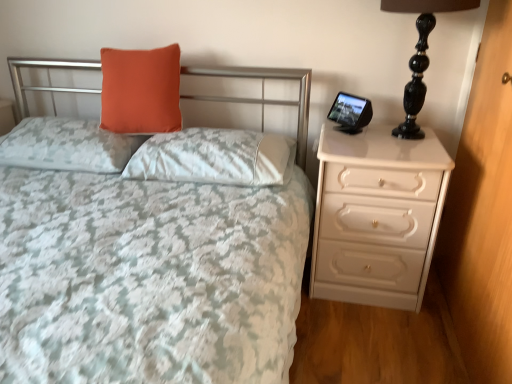
Question: Considering the relative sizes of matte white bedspread at center and white glossy dresser at right in the image provided, is matte white bedspread at center taller than white glossy dresser at right?

Choices:
 (A) yes
 (B) no

Answer: (B)

Question: Can you confirm if matte white bedspread at center is positioned to the right of white glossy dresser at right?

Choices:
 (A) no
 (B) yes

Answer: (A)

Question: Is matte white bedspread at center further to the viewer compared to white glossy dresser at right?

Choices:
 (A) no
 (B) yes

Answer: (A)

Question: Considering the relative positions of matte white bedspread at center and white glossy dresser at right in the image provided, is matte white bedspread at center in front of white glossy dresser at right?

Choices:
 (A) no
 (B) yes

Answer: (B)

Question: From a real-world perspective, is matte white bedspread at center under white glossy dresser at right?

Choices:
 (A) yes
 (B) no

Answer: (A)

Question: Considering the positions of white glossy dresser at right and white glossy chest of drawers at right in the image, is white glossy dresser at right taller or shorter than white glossy chest of drawers at right?

Choices:
 (A) tall
 (B) short

Answer: (A)

Question: Is white glossy dresser at right inside or outside of white glossy chest of drawers at right?

Choices:
 (A) inside
 (B) outside

Answer: (B)

Question: Is white glossy dresser at right bigger or smaller than white glossy chest of drawers at right?

Choices:
 (A) small
 (B) big

Answer: (A)

Question: In the image, is white glossy dresser at right on the left side or the right side of white glossy chest of drawers at right?

Choices:
 (A) right
 (B) left

Answer: (A)

Question: Considering the positions of matte white bedspread at center and orange matte pillow at upper center, which is the 2th pillow in left-to-right order, in the image, is matte white bedspread at center wider or thinner than orange matte pillow at upper center, which is the 2th pillow in left-to-right order,?

Choices:
 (A) thin
 (B) wide

Answer: (B)

Question: Does point pos(19,72) appear closer or farther from the camera than point pos(101,104)?

Choices:
 (A) farther
 (B) closer

Answer: (A)

Question: From a real-world perspective, relative to orange matte pillow at upper center, which is the 2th pillow in left-to-right order, is matte white bedspread at center vertically above or below?

Choices:
 (A) below
 (B) above

Answer: (A)

Question: Based on their sizes in the image, would you say matte white bedspread at center is bigger or smaller than orange matte pillow at upper center, which is the 2th pillow in left-to-right order?

Choices:
 (A) small
 (B) big

Answer: (B)

Question: Does point (19, 100) appear closer or farther from the camera than point (331, 175)?

Choices:
 (A) farther
 (B) closer

Answer: (A)

Question: From a real-world perspective, is matte white bedspread at center physically located above or below white glossy chest of drawers at right?

Choices:
 (A) below
 (B) above

Answer: (B)